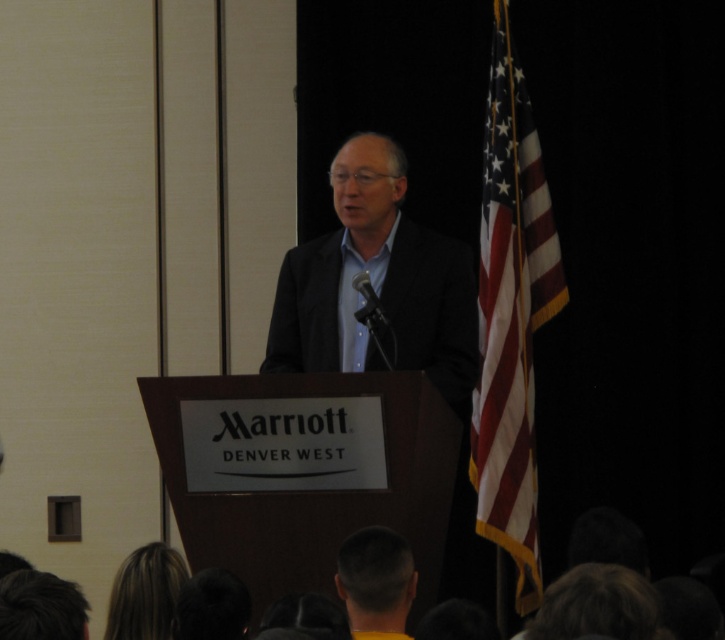
You are organizing a photo shoot and need to ensure that the dark gray suit at center and the american flag at right are visible in the frame. Based on their positions, which object should you focus on first to capture both in the shot?

The dark gray suit at center is located above the american flag at right, so focusing on the dark gray suit at center first will ensure both are visible in the frame.

You are a photographer at the event. You need to capture a photo of the american flag at right. Where exactly should you position your camera to ensure the flag is centered in the frame? The podium is at the center of the image. Use the coordinate system where the bottom left corner is 0,0 and the top right is 1,1. The flag is located at point (510,316). The camera can only move along the horizontal axis. What is the x coordinate you should aim for?

To center the american flag at right in the frame while moving only along the horizontal axis, the camera should be positioned at x coordinate 0.494. This ensures the flag remains centered horizontally since the vertical position is already at 0.706, which aligns with the flag location.

You are standing in the audience at the Marriott Denver West event. You want to know how far the point at coordinates point (624, 572) is from you. Can you determine the distance?

The point at coordinates point (624, 572) is 12.57 feet away from you.